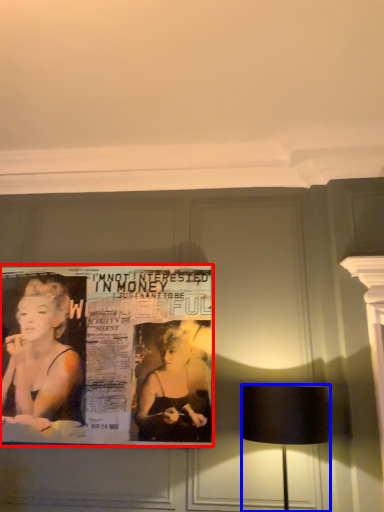
Question: Among these objects, which one is nearest to the camera, poster (highlighted by a red box) or lamp (highlighted by a blue box)?

Choices:
 (A) poster
 (B) lamp

Answer: (B)